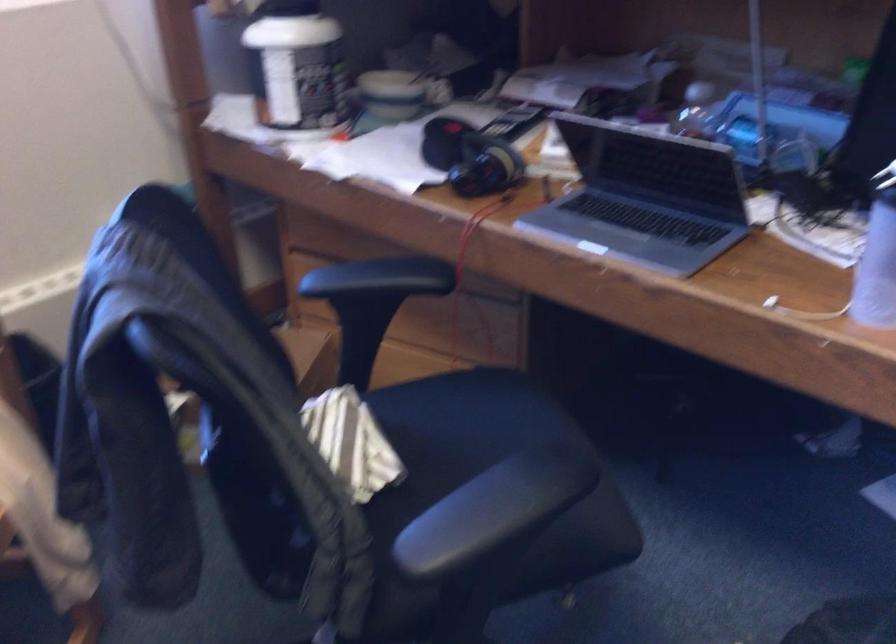
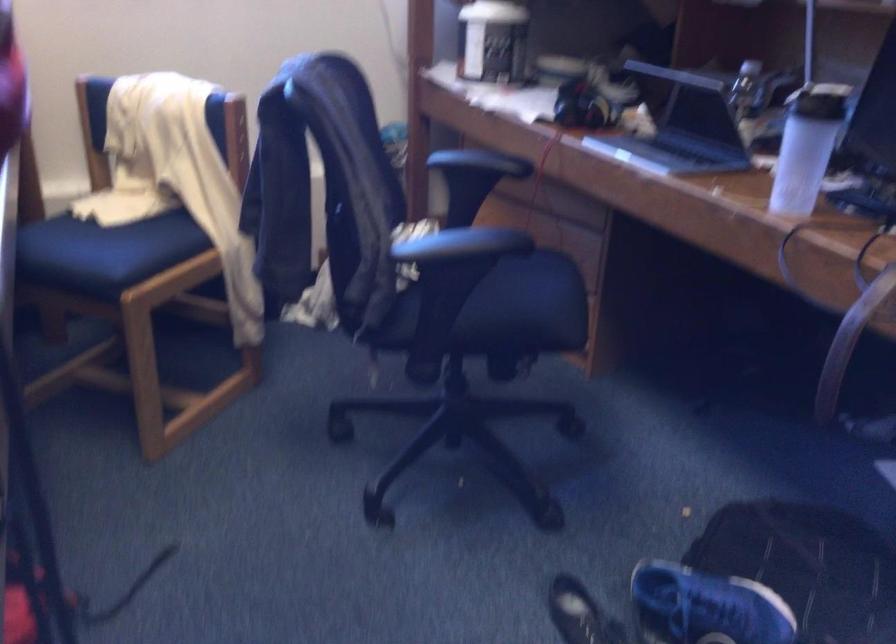
Locate, in the second image, the point that corresponds to point (519, 496) in the first image.

(471, 242)